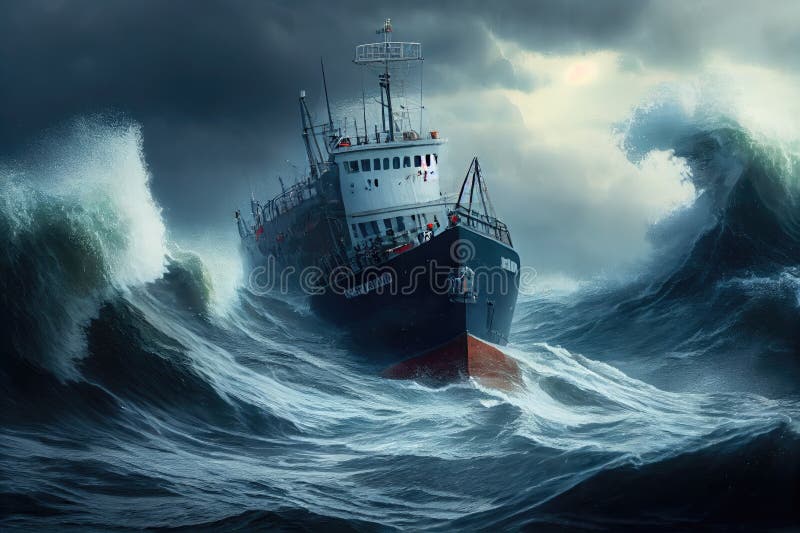
The width and height of the screenshot is (800, 533). Identify the location of windows. (350, 166), (369, 165), (390, 166), (405, 166), (417, 161).